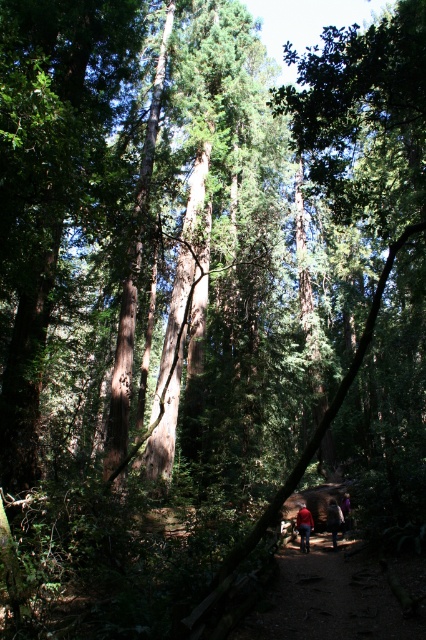
Question: Is red matte jacket at center thinner than dark brown leather jacket at center?

Choices:
 (A) no
 (B) yes

Answer: (A)

Question: In this image, where is red matte jacket at center located relative to purple fabric at center?

Choices:
 (A) above
 (B) below

Answer: (A)

Question: Which point appears closest to the camera in this image?

Choices:
 (A) (328, 520)
 (B) (348, 493)
 (C) (302, 548)

Answer: (C)

Question: Does dark brown leather jacket at center have a larger size compared to purple fabric at center?

Choices:
 (A) yes
 (B) no

Answer: (A)

Question: Among these objects, which one is nearest to the camera?

Choices:
 (A) purple fabric at center
 (B) red matte jacket at center
 (C) dark brown leather jacket at center

Answer: (C)

Question: Among these objects, which one is nearest to the camera?

Choices:
 (A) dark brown leather jacket at center
 (B) red matte jacket at center
 (C) purple fabric at center

Answer: (A)